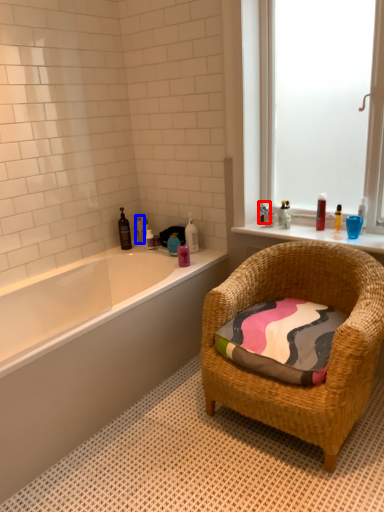
Question: Among these objects, which one is nearest to the camera, toiletry (highlighted by a red box) or toiletry (highlighted by a blue box)?

Choices:
 (A) toiletry
 (B) toiletry

Answer: (A)